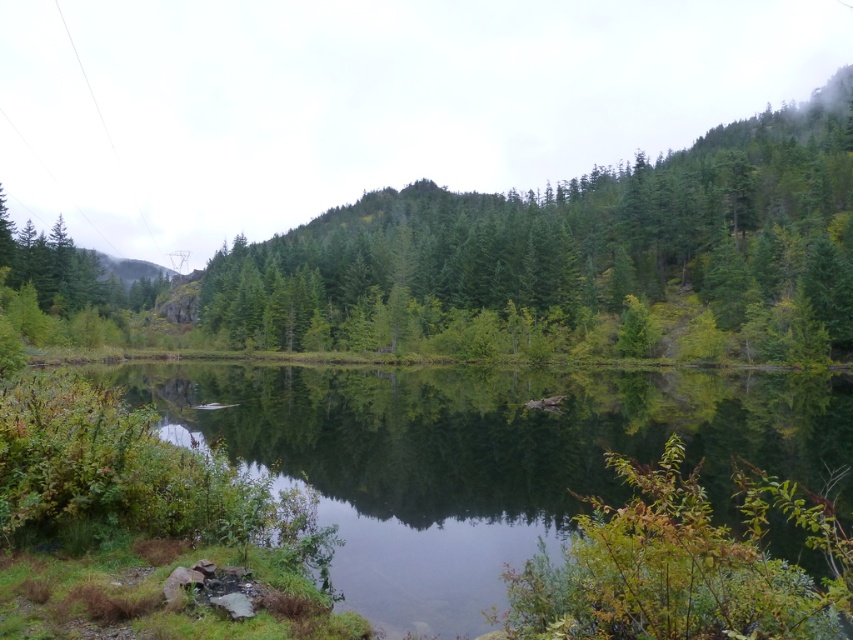
Question: Among these objects, which one is nearest to the camera?

Choices:
 (A) green matte tree at center
 (B) green glossy water at center

Answer: (B)

Question: Which point is farther to the camera?

Choices:
 (A) (619, 300)
 (B) (466, 481)

Answer: (A)

Question: Which point is closer to the camera taking this photo?

Choices:
 (A) (453, 467)
 (B) (338, 230)

Answer: (A)

Question: From the image, what is the correct spatial relationship of green glossy water at center in relation to green matte tree at center?

Choices:
 (A) right
 (B) left

Answer: (B)

Question: Is green glossy water at center smaller than green matte tree at center?

Choices:
 (A) no
 (B) yes

Answer: (B)

Question: Where is green glossy water at center located in relation to green matte tree at center in the image?

Choices:
 (A) right
 (B) left

Answer: (B)